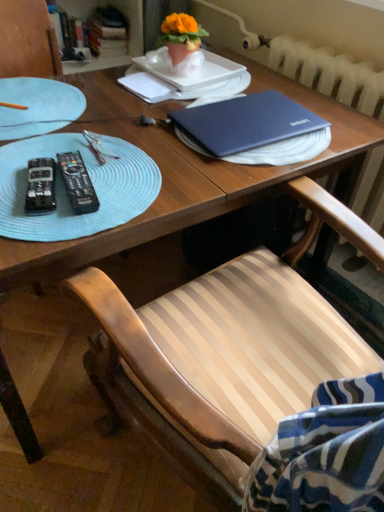
Locate an element on the screen. Image resolution: width=384 pixels, height=512 pixels. vacant region to the left of matte blue laptop at center is located at coordinates (137, 141).